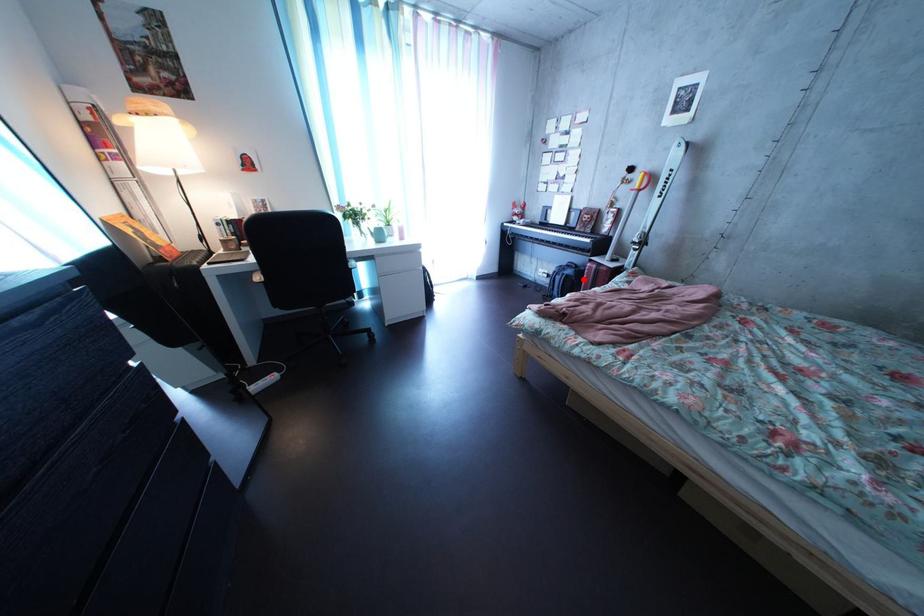
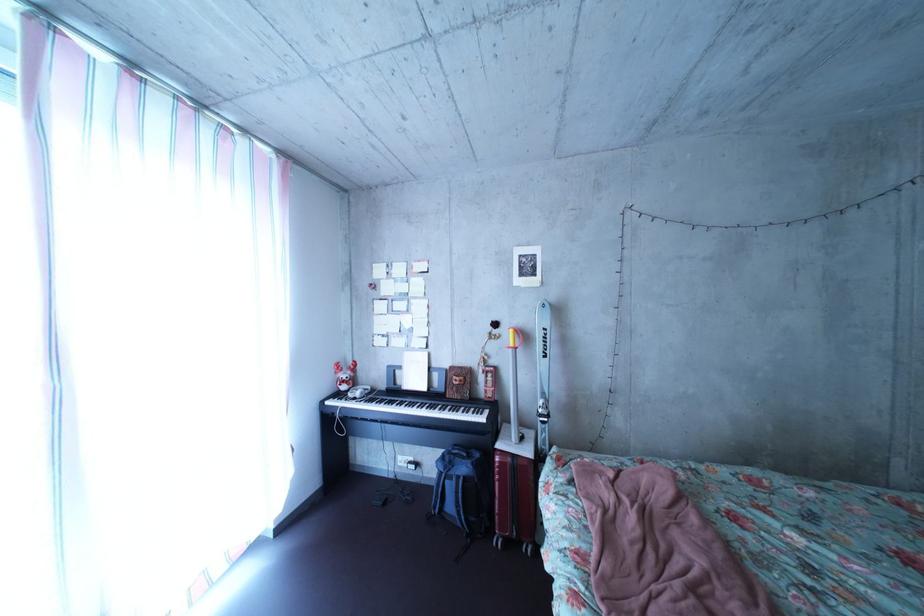
Question: I am providing you with two images of the same scene from different viewpoints. A red point is shown in image1. For the corresponding object point in image2, is it positioned nearer or farther from the camera?

Choices:
 (A) Nearer
 (B) Farther

Answer: (B)